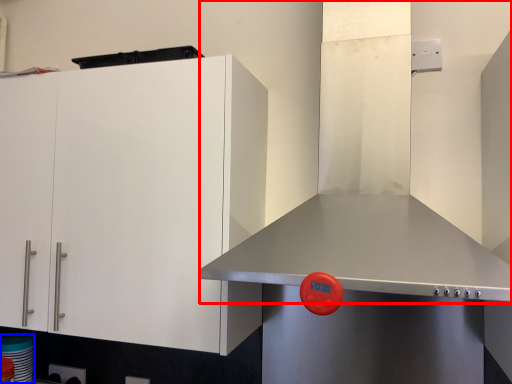
Question: Which of the following is the closest to the observer, exhaust hood (highlighted by a red box) or appliance (highlighted by a blue box)?

Choices:
 (A) exhaust hood
 (B) appliance

Answer: (A)